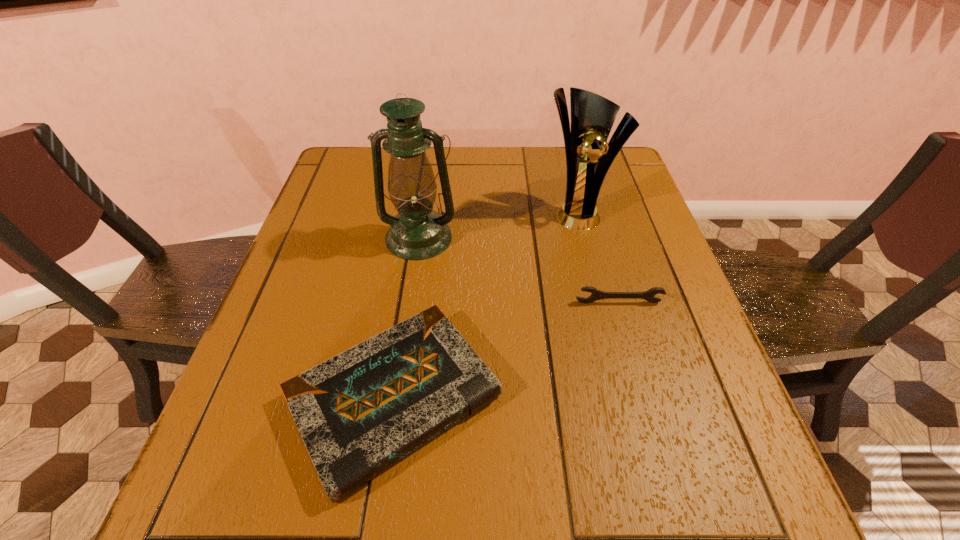
This screenshot has height=540, width=960. I want to click on award positioned at the right edge, so click(592, 116).

Identify the location of wrench located in the right edge section of the desktop. (596, 294).

Image resolution: width=960 pixels, height=540 pixels. Find the location of `object present at the near left corner`. object present at the near left corner is located at coordinates (359, 412).

At what (x,y) coordinates should I click in order to perform the action: click on free space at the far edge of the desktop. Please return your answer as a coordinate pair (x, y). Looking at the image, I should click on (564, 147).

I want to click on vacant space at the near edge of the desktop, so click(542, 496).

In the image, there is a desktop. Identify the location of vacant area at the left edge. The height and width of the screenshot is (540, 960). (333, 210).

What are the coordinates of `free space at the right edge` in the screenshot? It's located at (606, 238).

The image size is (960, 540). Find the location of `vacant space at the far right corner of the desktop`. vacant space at the far right corner of the desktop is located at coordinates (618, 167).

At what (x,y) coordinates should I click in order to perform the action: click on vacant space at the near right corner. Please return your answer as a coordinate pair (x, y). Looking at the image, I should click on 756,508.

I want to click on empty space between the award and the oil lamp, so click(497, 225).